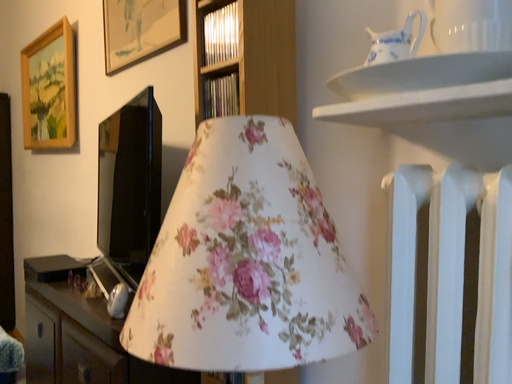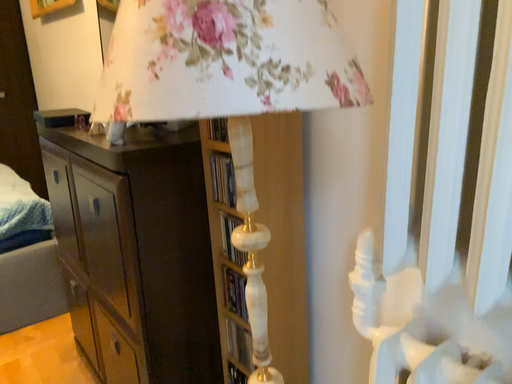
Question: How did the camera likely rotate when shooting the video?

Choices:
 (A) rotated upward
 (B) rotated downward

Answer: (B)